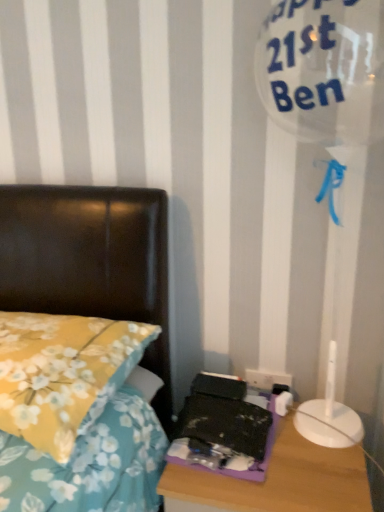
Identify the location of purple plastic nightstand at lower right. This screenshot has height=512, width=384. (276, 480).

In the scene shown: From the image's perspective, which is below, white plastic electric outlet at lower right or purple plastic nightstand at lower right?

purple plastic nightstand at lower right.

Considering the positions of objects white plastic electric outlet at lower right and purple plastic nightstand at lower right in the image provided, who is more to the left, white plastic electric outlet at lower right or purple plastic nightstand at lower right?

Positioned to the left is purple plastic nightstand at lower right.

Does white plastic electric outlet at lower right touch purple plastic nightstand at lower right?

No.

From the image's perspective, is purple plastic nightstand at lower right on top of yellow floral fabric pillow at left?

No, from the image's perspective, purple plastic nightstand at lower right is not on top of yellow floral fabric pillow at left.

Which is nearer, [287,444] or [0,357]?

The point [0,357] is closer to the camera.

Is purple plastic nightstand at lower right bigger than yellow floral fabric pillow at left?

Yes.

The height and width of the screenshot is (512, 384). What are the coordinates of `pillow that is above the white plastic electric outlet at lower right (from the image's perspective)` in the screenshot? It's located at (63, 374).

From the image's perspective, is white plastic electric outlet at lower right located above or below yellow floral fabric pillow at left?

Clearly, from the image's perspective, white plastic electric outlet at lower right is below yellow floral fabric pillow at left.

Are white plastic electric outlet at lower right and yellow floral fabric pillow at left making contact?

No, white plastic electric outlet at lower right is not with yellow floral fabric pillow at left.

Between white plastic electric outlet at lower right and yellow floral fabric pillow at left, which one has larger size?

Bigger between the two is yellow floral fabric pillow at left.

In the image, is yellow floral fabric pillow at left positioned in front of or behind white plastic electric outlet at lower right?

Visually, yellow floral fabric pillow at left is located in front of white plastic electric outlet at lower right.

Would you say yellow floral fabric pillow at left contains white plastic electric outlet at lower right?

No, yellow floral fabric pillow at left does not contain white plastic electric outlet at lower right.

Can you confirm if yellow floral fabric pillow at left is positioned to the left of white plastic electric outlet at lower right?

Correct, you'll find yellow floral fabric pillow at left to the left of white plastic electric outlet at lower right.

Is yellow floral fabric pillow at left thinner than purple plastic nightstand at lower right?

Incorrect, the width of yellow floral fabric pillow at left is not less than that of purple plastic nightstand at lower right.

Which object is closer to the camera, yellow floral fabric pillow at left or purple plastic nightstand at lower right?

yellow floral fabric pillow at left is in front.

Which is behind, point (37, 395) or point (208, 508)?

The point (208, 508) is farther.

Is yellow floral fabric pillow at left not near purple plastic nightstand at lower right?

No.

From a real-world perspective, relative to white plastic electric outlet at lower right, is purple plastic nightstand at lower right vertically above or below?

From a real-world perspective, purple plastic nightstand at lower right is physically below white plastic electric outlet at lower right.

Considering the relative sizes of purple plastic nightstand at lower right and white plastic electric outlet at lower right in the image provided, is purple plastic nightstand at lower right taller than white plastic electric outlet at lower right?

Yes.

Is point (209, 493) closer to viewer compared to point (253, 374)?

Yes, point (209, 493) is in front of point (253, 374).

Image resolution: width=384 pixels, height=512 pixels. In order to click on nightstand on the left of the white plastic electric outlet at lower right in this screenshot , I will do `click(276, 480)`.

The width and height of the screenshot is (384, 512). Find the location of `nightstand behind the yellow floral fabric pillow at left`. nightstand behind the yellow floral fabric pillow at left is located at coordinates (276, 480).

Based on their spatial positions, is white plastic electric outlet at lower right or purple plastic nightstand at lower right further from yellow floral fabric pillow at left?

white plastic electric outlet at lower right lies further to yellow floral fabric pillow at left than the other object.

Looking at the image, which one is located closer to white plastic electric outlet at lower right, purple plastic nightstand at lower right or yellow floral fabric pillow at left?

Based on the image, purple plastic nightstand at lower right appears to be nearer to white plastic electric outlet at lower right.

Which object lies further to the anchor point white plastic electric outlet at lower right, yellow floral fabric pillow at left or purple plastic nightstand at lower right?

yellow floral fabric pillow at left lies further to white plastic electric outlet at lower right than the other object.

Looking at the image, which one is located closer to purple plastic nightstand at lower right, white plastic electric outlet at lower right or yellow floral fabric pillow at left?

Among the two, white plastic electric outlet at lower right is located nearer to purple plastic nightstand at lower right.

From the image, which object appears to be farther from yellow floral fabric pillow at left, purple plastic nightstand at lower right or white plastic electric outlet at lower right?

white plastic electric outlet at lower right is positioned further to the anchor yellow floral fabric pillow at left.

Estimate the real-world distances between objects in this image. Which object is further from purple plastic nightstand at lower right, yellow floral fabric pillow at left or white plastic electric outlet at lower right?

yellow floral fabric pillow at left is positioned further to the anchor purple plastic nightstand at lower right.

At what (x,y) coordinates should I click in order to perform the action: click on nightstand located between yellow floral fabric pillow at left and white plastic electric outlet at lower right in the left-right direction. Please return your answer as a coordinate pair (x, y). This screenshot has height=512, width=384. Looking at the image, I should click on [276, 480].